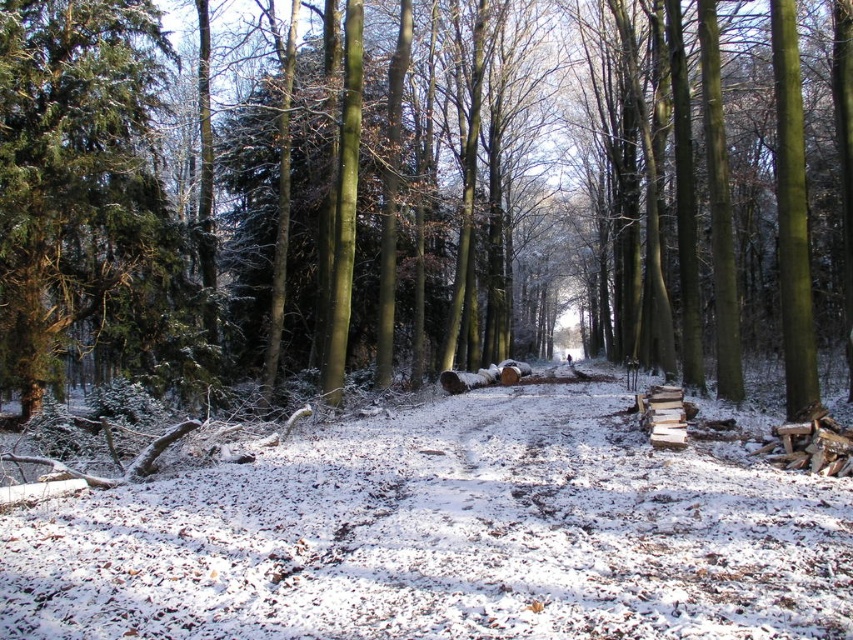
You are a hiker planning to take a photo of both the green matte tree at center and the green textured evergreen tree at left. Which tree should you stand closer to in order to capture both in a single frame without zooming?

You should stand closer to the green textured evergreen tree at left because the green matte tree at center is much taller, so moving closer to the shorter tree will help balance their sizes in the photo.